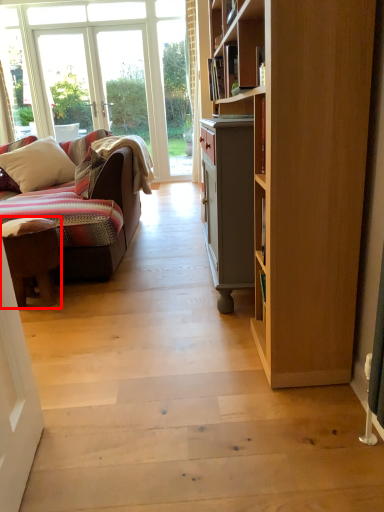
Question: From the image's perspective, what is the correct spatial relationship of desk (annotated by the red box) in relation to pillow?

Choices:
 (A) above
 (B) below

Answer: (B)